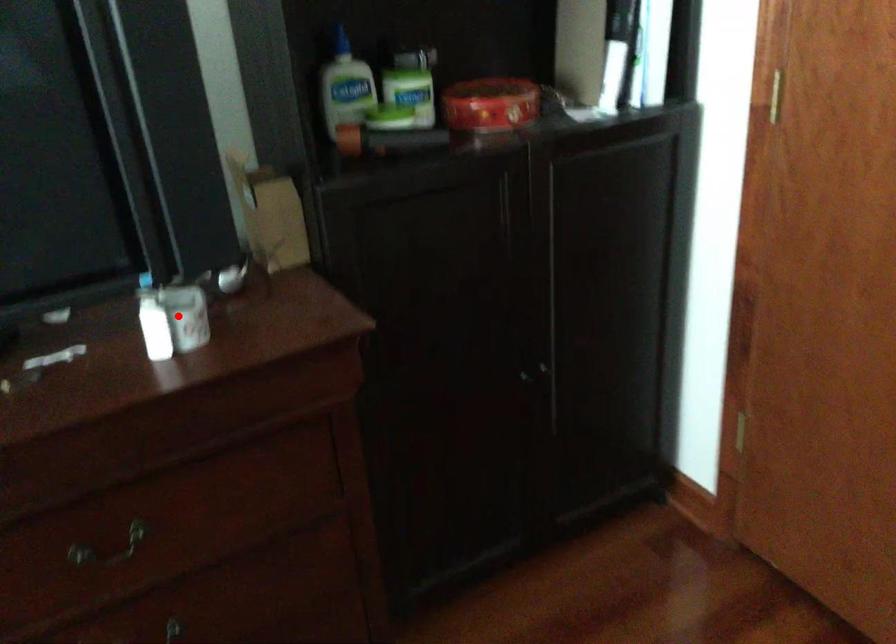
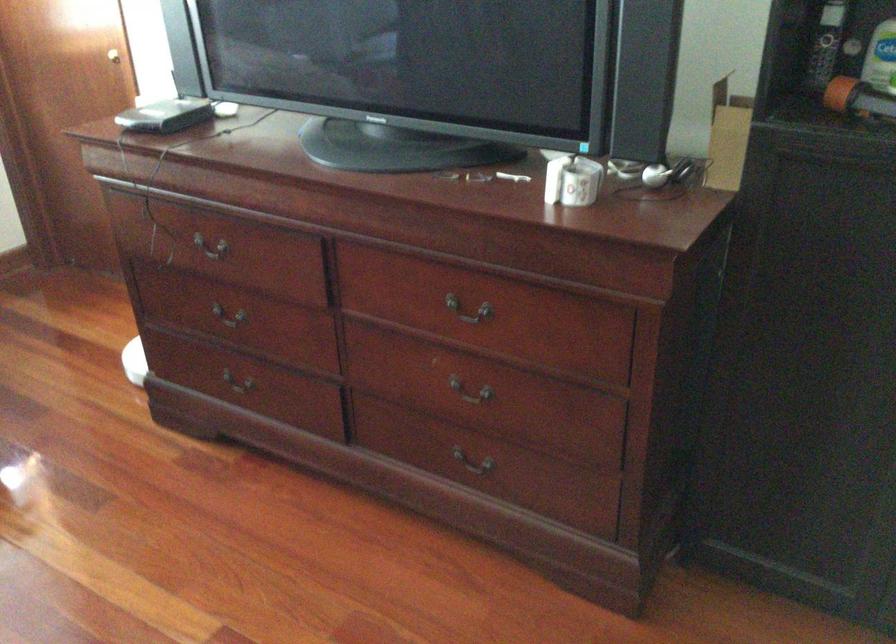
Question: I am providing you with two images of the same scene from different viewpoints. Given a red point in image1, look at the same physical point in image2. Is it:

Choices:
 (A) Closer to the viewpoint
 (B) Farther from the viewpoint

Answer: (B)